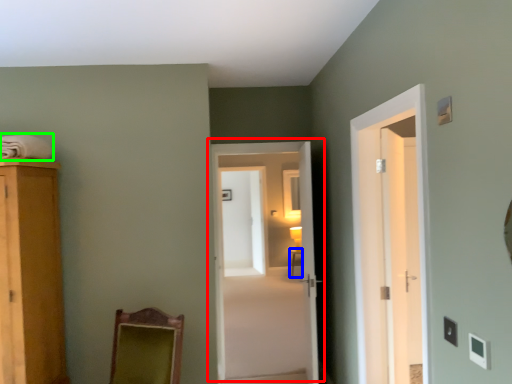
Question: Which object is the farthest from door (highlighted by a red box)? Choose among these: table (highlighted by a blue box) or laundry (highlighted by a green box).

Choices:
 (A) table
 (B) laundry

Answer: (A)